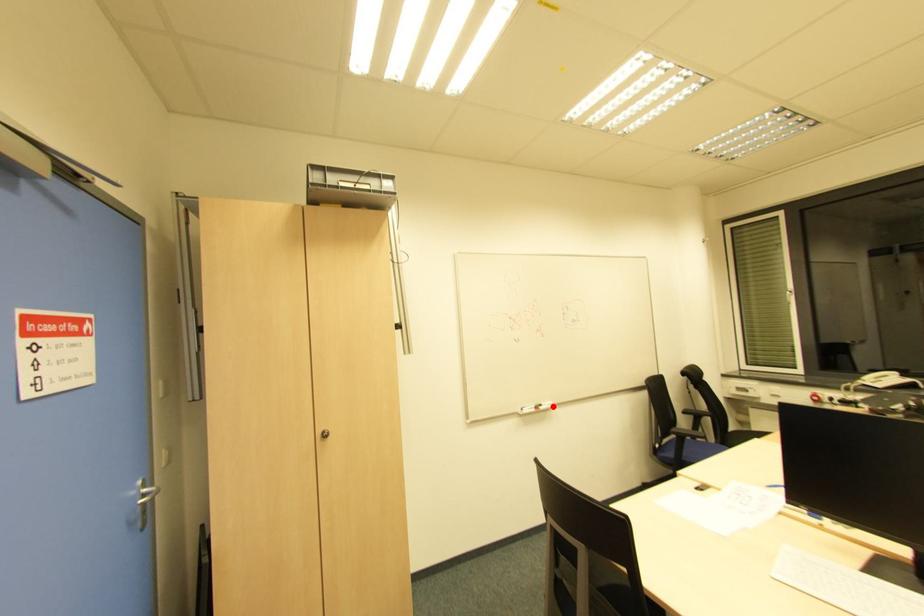
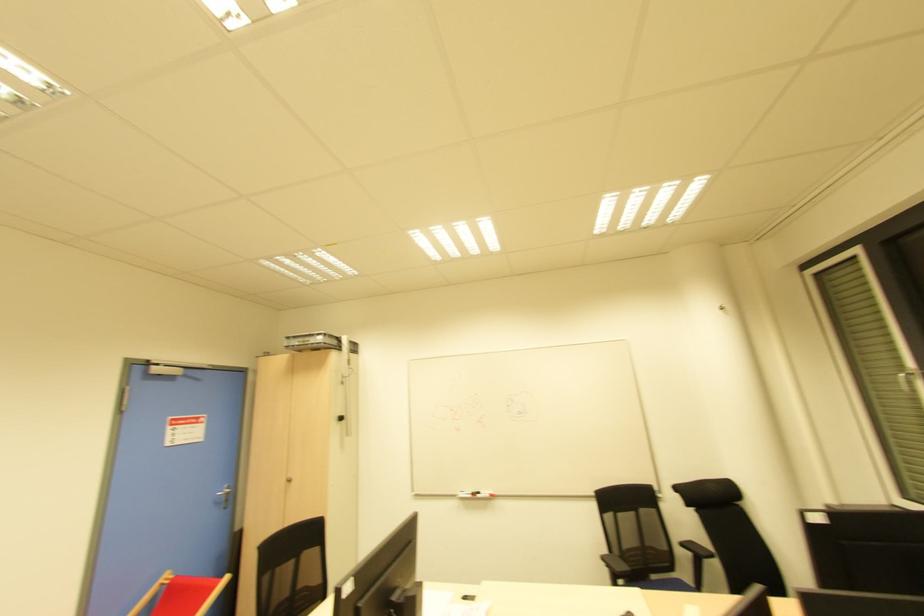
Find the pixel in the second image that matches the highlighted location in the first image.

(492, 496)